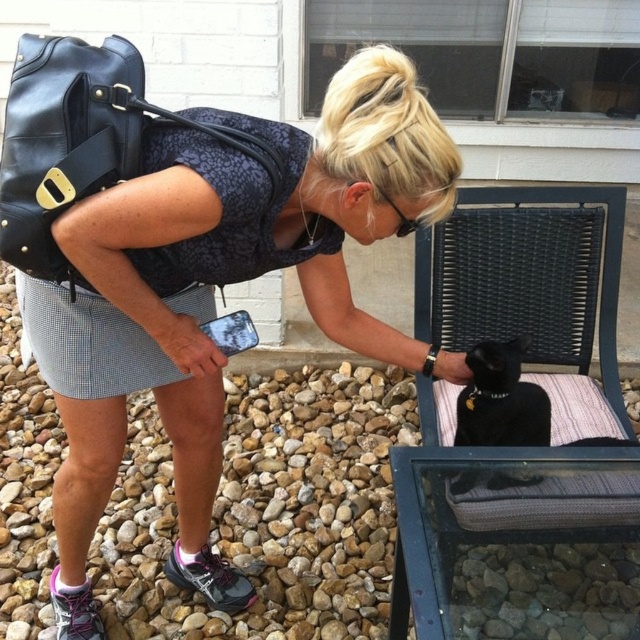
Is matte black purse at upper left below black woven fabric folding chair at lower right?

Indeed, matte black purse at upper left is positioned under black woven fabric folding chair at lower right.

Between matte black purse at upper left and black woven fabric folding chair at lower right, which one appears on the left side from the viewer's perspective?

Positioned to the left is matte black purse at upper left.

From the picture: Measure the distance between point (211, 593) and camera.

Answer: Point (211, 593) and camera are 6.17 feet apart.

Locate an element on the screen. This screenshot has height=640, width=640. matte black purse at upper left is located at coordinates (220, 285).

Between matte black purse at upper left and black matte fur cat at lower right, which one appears on the left side from the viewer's perspective?

Positioned to the left is matte black purse at upper left.

Identify the location of matte black purse at upper left. (220, 285).

Identify the location of matte black purse at upper left. (220, 285).

Does point (556, 627) lie in front of point (547, 400)?

Yes, point (556, 627) is in front of point (547, 400).

Can you confirm if black woven fabric folding chair at lower right is positioned above black matte fur cat at lower right?

Yes, black woven fabric folding chair at lower right is above black matte fur cat at lower right.

Between point (554, 353) and point (493, 401), which one is positioned behind?

Point (554, 353)

In order to click on black woven fabric folding chair at lower right in this screenshot , I will do `click(522, 448)`.